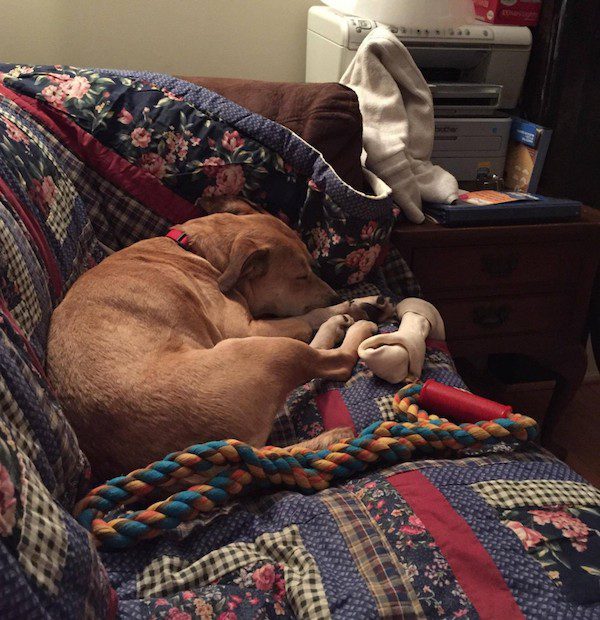
Locate an element on the screen. Image resolution: width=600 pixels, height=620 pixels. towel is located at coordinates (375, 121), (421, 118).